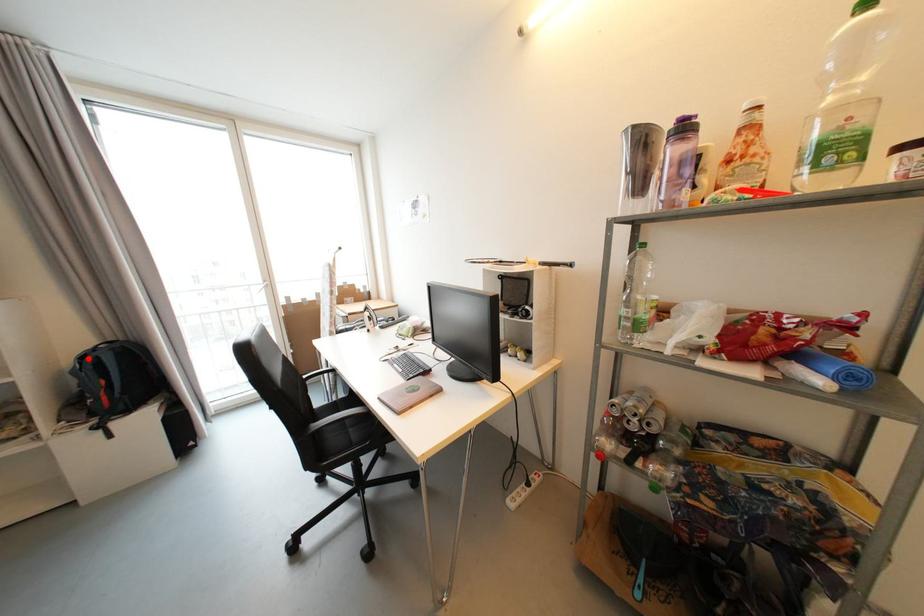
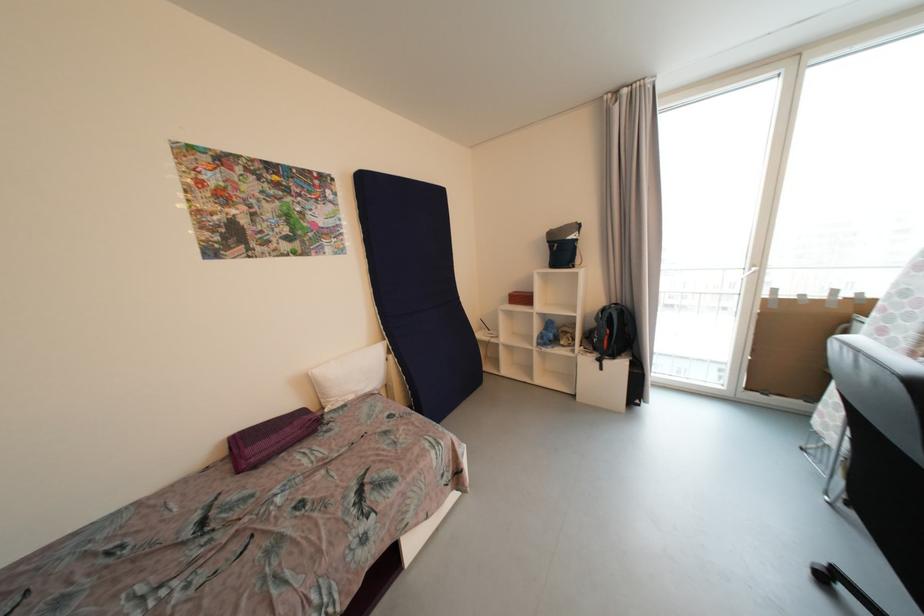
Find the pixel in the second image that matches the highlighted location in the first image.

(608, 312)